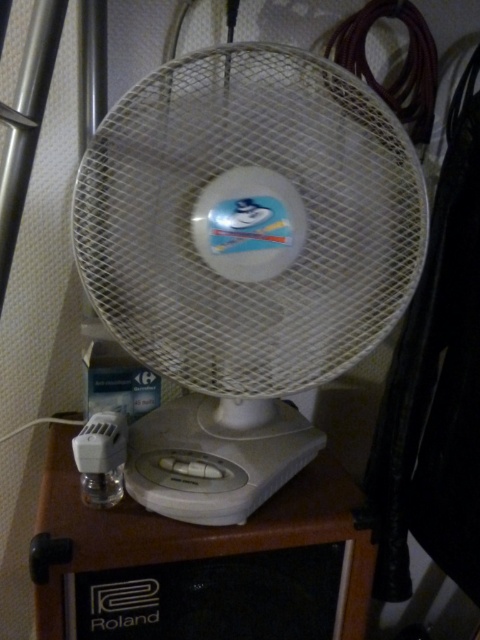
You are standing in a room and want to reach the white plastic fan at center to adjust its settings. If your outstretched hand can reach up to 20 inches, will you be able to touch the fan?

The white plastic fan at center is 22.25 inches away from the camera, so your hand can only reach up to 20 inches. Therefore, you cannot touch the fan.

You are standing in front of the white plastic fan at center. There is a small white device to its left. Can you determine the position of the small white device relative to the fan?

The small white device is to the left of the white plastic fan at center.